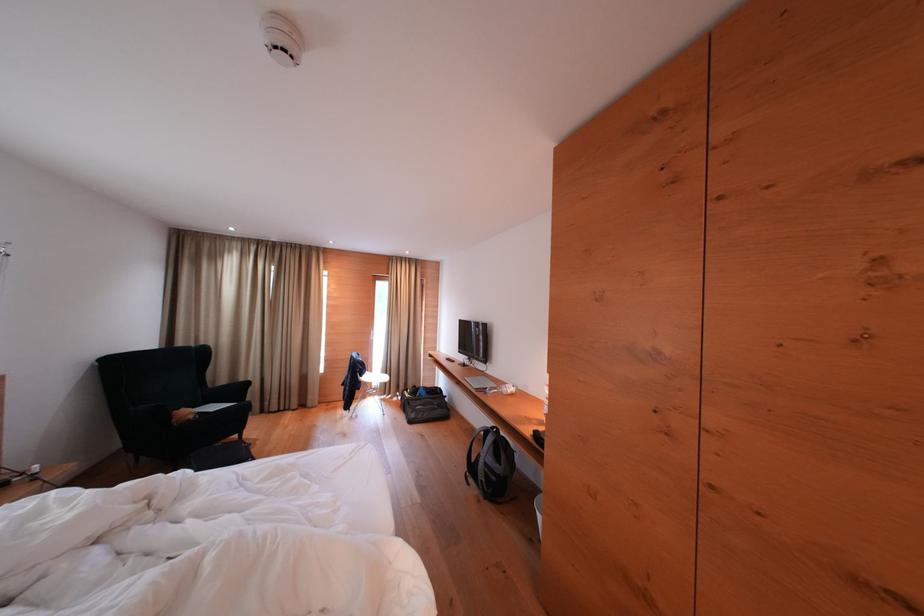
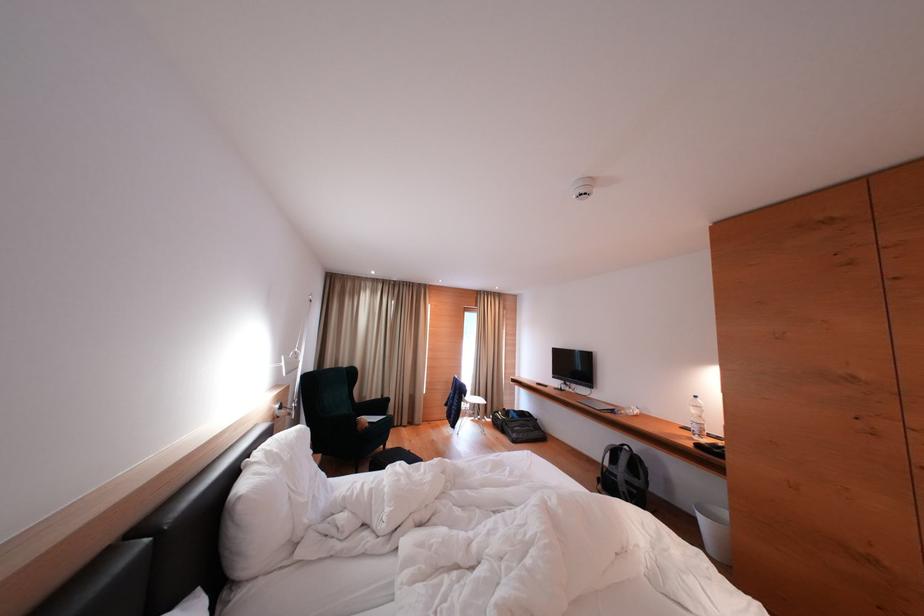
Locate, in the second image, the point that corresponds to [428,395] in the first image.

(518, 418)